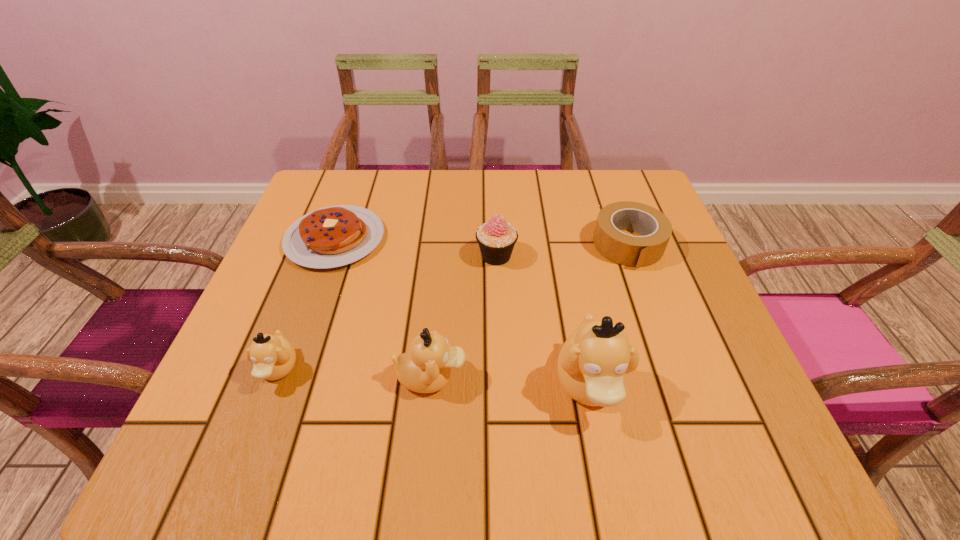
What are the coordinates of `object that is at the near left corner` in the screenshot? It's located at (273, 356).

At what (x,y) coordinates should I click in order to perform the action: click on object at the far right corner. Please return your answer as a coordinate pair (x, y). The width and height of the screenshot is (960, 540). Looking at the image, I should click on (634, 251).

What are the coordinates of `vacant area at the far edge of the desktop` in the screenshot? It's located at (402, 207).

Find the location of a particular element. The image size is (960, 540). vacant space at the near edge of the desktop is located at coordinates (318, 384).

This screenshot has width=960, height=540. In order to click on vacant space at the left edge of the desktop in this screenshot , I will do `click(241, 346)`.

Image resolution: width=960 pixels, height=540 pixels. In the image, there is a desktop. What are the coordinates of `vacant area at the far left corner` in the screenshot? It's located at (314, 200).

Locate an element on the screen. vacant space at the near right corner of the desktop is located at coordinates (652, 388).

This screenshot has width=960, height=540. What are the coordinates of `free area in between the pancake and the second duckling from right to left` in the screenshot? It's located at (383, 308).

Locate an element on the screen. The height and width of the screenshot is (540, 960). free space that is in between the third object from right to left and the duct tape is located at coordinates (563, 251).

Image resolution: width=960 pixels, height=540 pixels. Find the location of `unoccupied position between the duct tape and the second duckling from left to right`. unoccupied position between the duct tape and the second duckling from left to right is located at coordinates (530, 311).